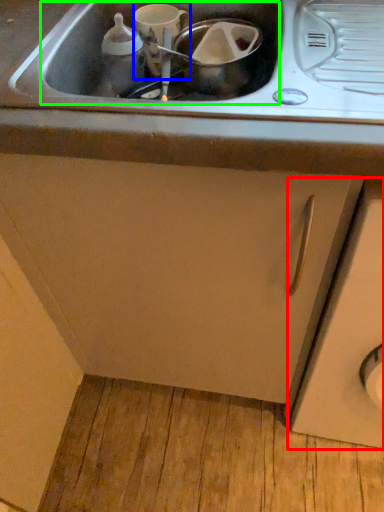
Question: Which is nearer to the cabinetry (highlighted by a red box)? appliance (highlighted by a blue box) or sink (highlighted by a green box).

Choices:
 (A) appliance
 (B) sink

Answer: (B)